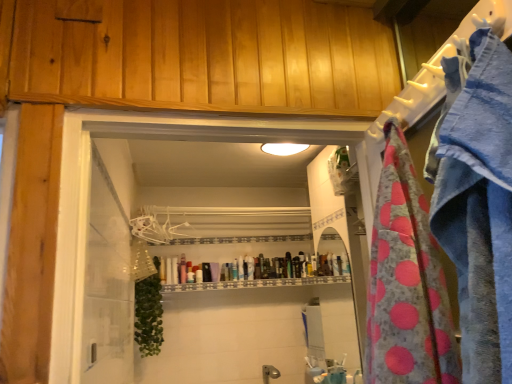
Question: Is pink polka dot fabric at right in front of or behind translucent plastic tube at center in the image?

Choices:
 (A) front
 (B) behind

Answer: (A)

Question: From a real-world perspective, is pink polka dot fabric at right positioned above or below translucent plastic tube at center?

Choices:
 (A) above
 (B) below

Answer: (B)

Question: Which is nearer to the white plastic hanger at upper center?

Choices:
 (A) translucent plastic tube at center
 (B) pink polka dot fabric at right

Answer: (A)

Question: Estimate the real-world distances between objects in this image. Which object is farther from the pink polka dot fabric at right?

Choices:
 (A) white plastic hanger at upper center
 (B) translucent plastic tube at center

Answer: (A)